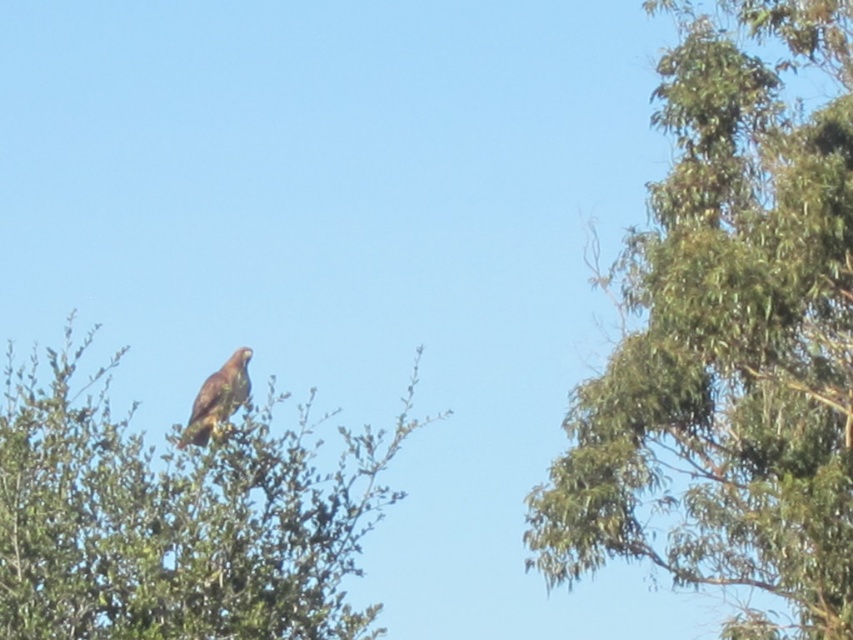
Identify the location of green leafy tree at upper left. (178, 515).

Can you confirm if green leafy tree at upper left is positioned to the right of brown feathered eagle at upper center?

Yes, green leafy tree at upper left is to the right of brown feathered eagle at upper center.

Is point (267, 456) farther from viewer compared to point (215, 390)?

No.

Locate an element on the screen. green leafy tree at upper left is located at coordinates (178, 515).

Can you confirm if green leafy tree at upper right is positioned above brown feathered eagle at upper center?

No, green leafy tree at upper right is not above brown feathered eagle at upper center.

Does point (718, 502) come farther from viewer compared to point (199, 422)?

Yes, it is.

The width and height of the screenshot is (853, 640). Identify the location of green leafy tree at upper right. (729, 340).

Does green leafy tree at upper right have a lesser width compared to green leafy tree at upper left?

No, green leafy tree at upper right is not thinner than green leafy tree at upper left.

Identify the location of green leafy tree at upper right. Image resolution: width=853 pixels, height=640 pixels. (729, 340).